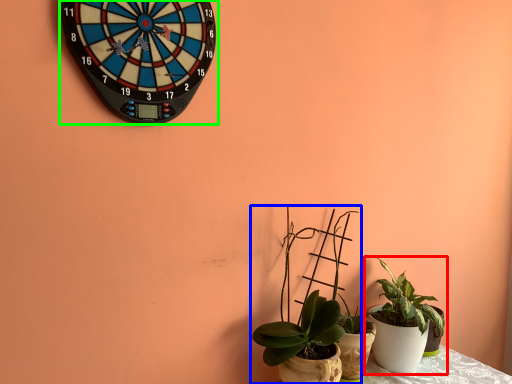
Question: Which is nearer to the houseplant (highlighted by a red box)? houseplant (highlighted by a blue box) or wall clock (highlighted by a green box).

Choices:
 (A) houseplant
 (B) wall clock

Answer: (A)